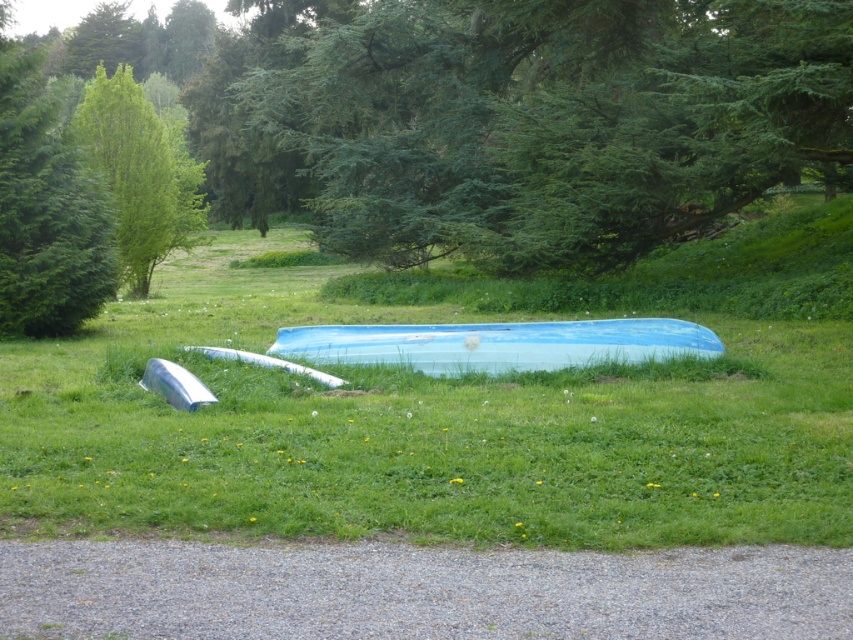
Is point (715, 333) farther from camera compared to point (138, 93)?

No, (715, 333) is closer to viewer.

Does light blue plastic boat at center have a larger size compared to green leafy tree at upper left?

Actually, light blue plastic boat at center might be smaller than green leafy tree at upper left.

This screenshot has height=640, width=853. I want to click on light blue plastic boat at center, so click(498, 344).

Locate an element on the screen. The image size is (853, 640). light blue plastic boat at center is located at coordinates (498, 344).

Is point (473, 76) more distant than point (438, 353)?

Yes, it is behind point (438, 353).

Identify the location of green textured tree at upper center. (556, 122).

Does green textured tree at upper center have a lesser width compared to green leafy tree at left?

In fact, green textured tree at upper center might be wider than green leafy tree at left.

Consider the image. Is the position of green textured tree at upper center more distant than that of green leafy tree at left?

No, green textured tree at upper center is in front of green leafy tree at left.

Which is in front, point (815, 112) or point (33, 72)?

Positioned in front is point (815, 112).

Identify the location of green textured tree at upper center. (556, 122).